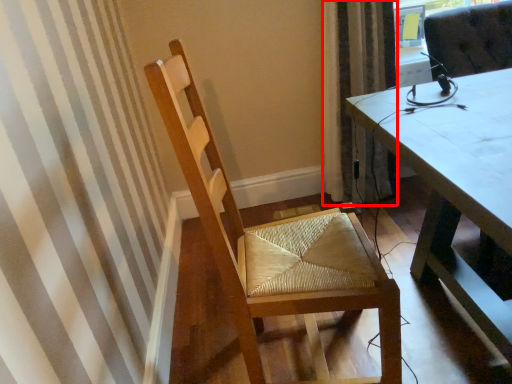
Question: In this image, where is curtain (annotated by the red box) located relative to chair?

Choices:
 (A) left
 (B) right

Answer: (B)